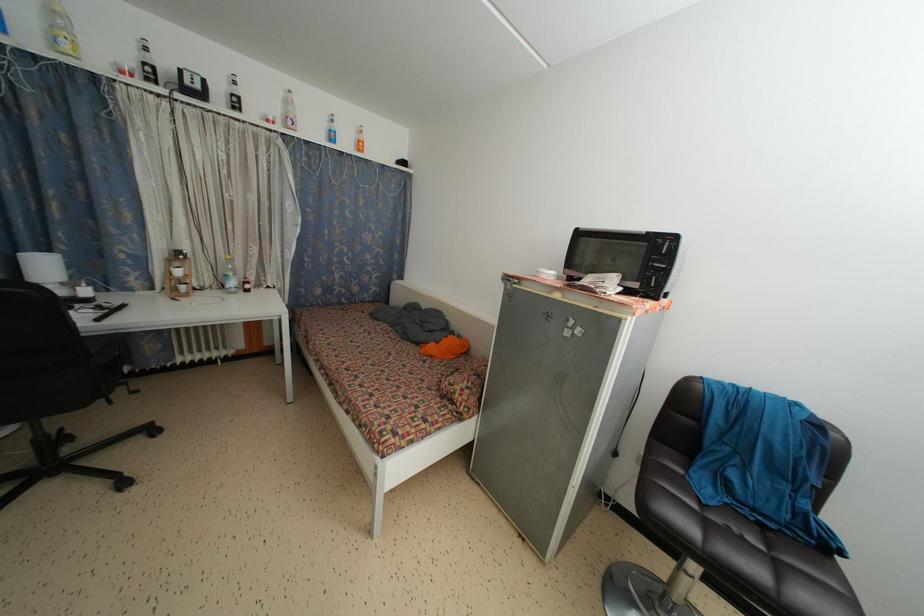
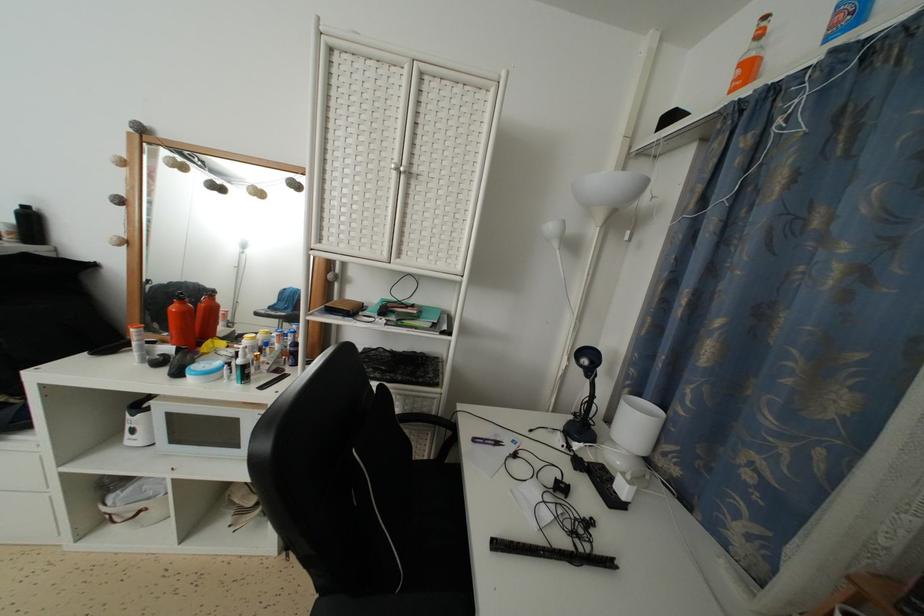
The point at (128, 312) is marked in the first image. Where is the corresponding point in the second image?

(614, 569)